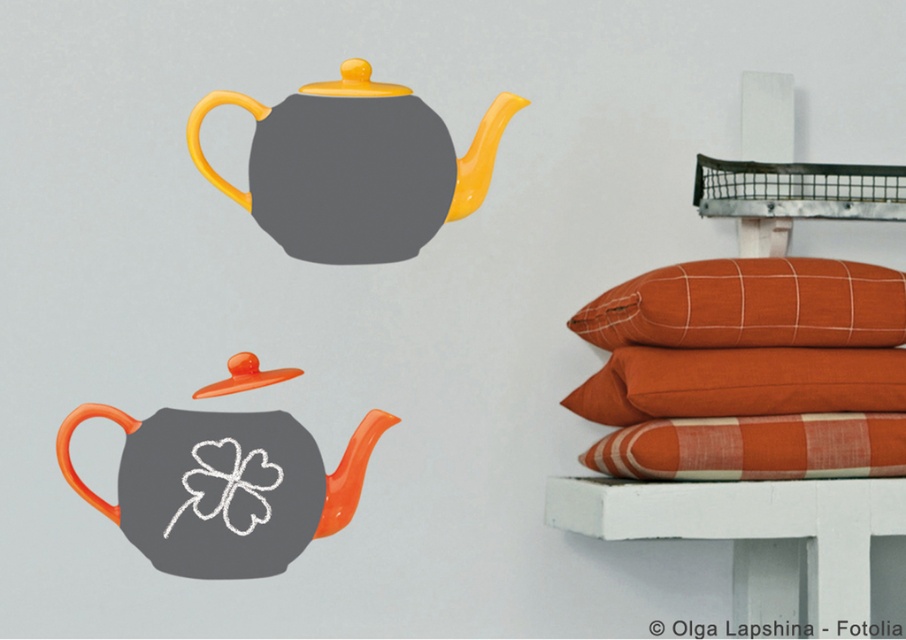
You are standing in front of the image and want to touch the two points marked in the scene. Which point, point (895, 346) or point (704, 416), would you reach first if you move your hand forward towards the image?

Point (895, 346) is further to the viewer than point (704, 416), so you would reach point (895, 346) first.

You are organizing a display in the image and need to place a decorative item between the two teapots. The orange cotton pillow at upper right is available. Based on its position, can you confirm if there is enough space between the teapots to place the pillow?

The orange cotton pillow at upper right is located at point (750, 305), which is to the right side of the image where the shelf with pillows is placed. Since the two teapots are positioned at the top and bottom left areas, there is sufficient space between them to accommodate the pillow.

You are arranging items on a shelf and need to place the matte orange teapot at center and the orange plaid pillow at right. According to the image, which item should be placed on the left side of the shelf?

The matte orange teapot at center should be placed on the left side of the shelf because it is to the left of the orange plaid pillow at right in the image.